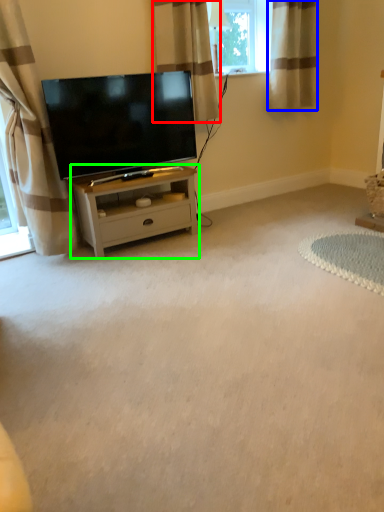
Question: Which is farther away from curtain (highlighted by a red box)? curtain (highlighted by a blue box) or nightstand (highlighted by a green box)?

Choices:
 (A) curtain
 (B) nightstand

Answer: (B)